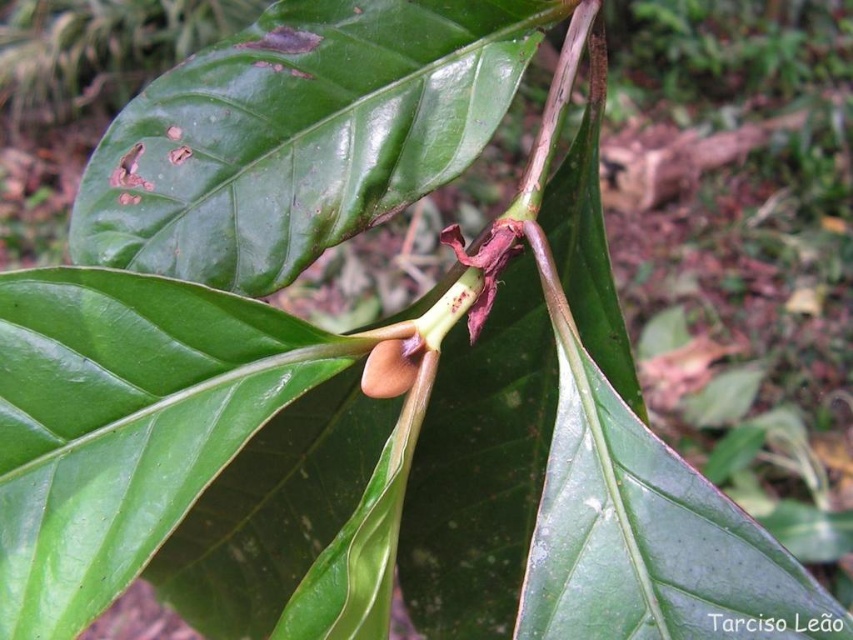
Question: Which object appears farthest from the camera in this image?

Choices:
 (A) green matte leaf at center
 (B) brown matte pod at center

Answer: (A)

Question: Which point is closer to the camera?

Choices:
 (A) green matte leaf at center
 (B) brown matte pod at center

Answer: (B)

Question: Does green matte leaf at center lie in front of brown matte pod at center?

Choices:
 (A) no
 (B) yes

Answer: (A)

Question: Can you confirm if green matte leaf at center is bigger than brown matte pod at center?

Choices:
 (A) no
 (B) yes

Answer: (B)

Question: Which point is closer to the camera?

Choices:
 (A) (410, 385)
 (B) (141, 202)

Answer: (A)

Question: Does green matte leaf at center appear over brown matte pod at center?

Choices:
 (A) no
 (B) yes

Answer: (B)